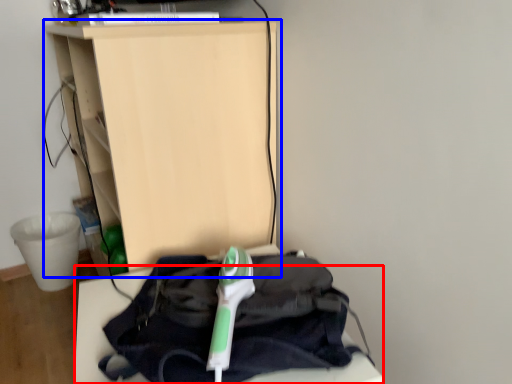
Question: Among these objects, which one is nearest to the camera, furniture (highlighted by a red box) or furniture (highlighted by a blue box)?

Choices:
 (A) furniture
 (B) furniture

Answer: (A)